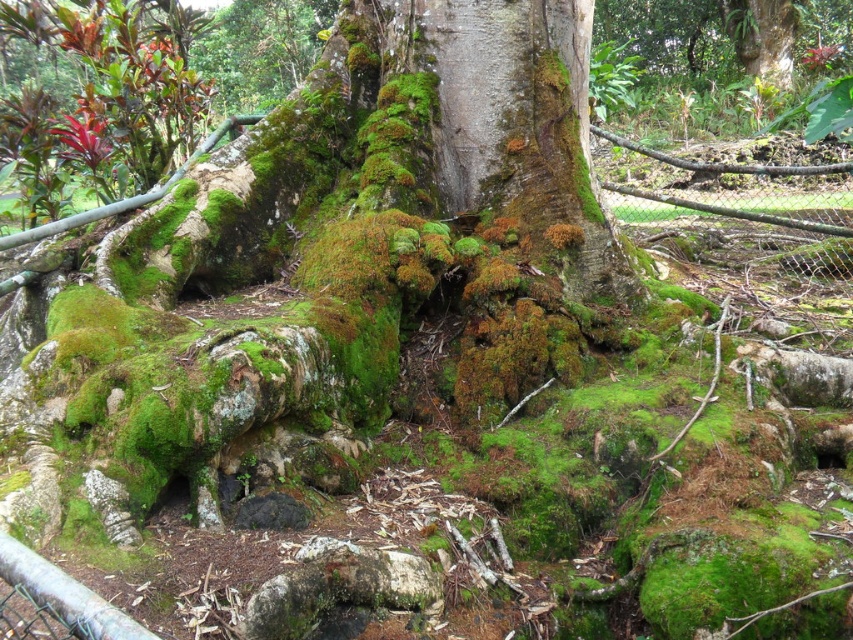
Which is in front, point (480, 172) or point (682, 166)?

Point (480, 172)

Which is more to the right, green mossy bark at center or wire mesh fence at lower right?

Positioned to the right is wire mesh fence at lower right.

Between point (438, 88) and point (842, 224), which one is positioned behind?

The point (842, 224) is behind.

Identify the location of green mossy bark at center. (514, 122).